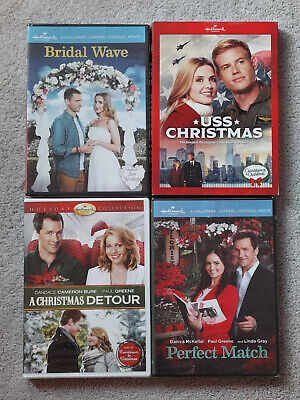
You are a GUI agent. You are given a task and a screenshot of the screen. Output one action in this format:
    pyautogui.click(x=<x>, y=<y>)
    Task: Click on the dvds
    
    Given the screenshot: What is the action you would take?
    pyautogui.click(x=109, y=144), pyautogui.click(x=177, y=142), pyautogui.click(x=177, y=230), pyautogui.click(x=102, y=238)